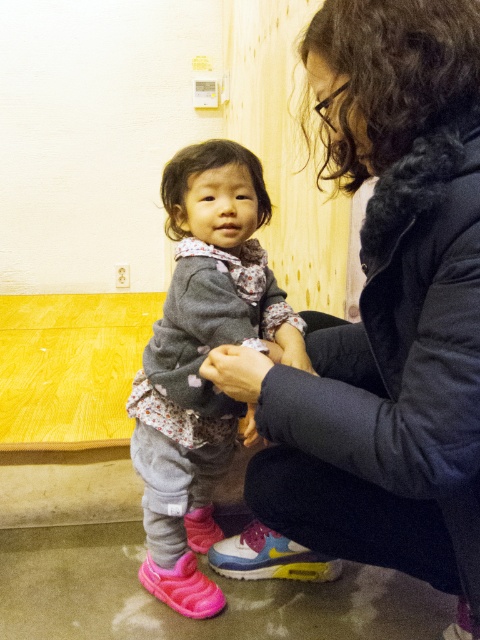
Can you confirm if matte black jacket at center is positioned below matte gray sweater at center?

No, matte black jacket at center is not below matte gray sweater at center.

Does matte black jacket at center appear on the right side of matte gray sweater at center?

Indeed, matte black jacket at center is positioned on the right side of matte gray sweater at center.

At what (x,y) coordinates should I click in order to perform the action: click on matte black jacket at center. Please return your answer as a coordinate pair (x, y). This screenshot has height=640, width=480. Looking at the image, I should click on (386, 310).